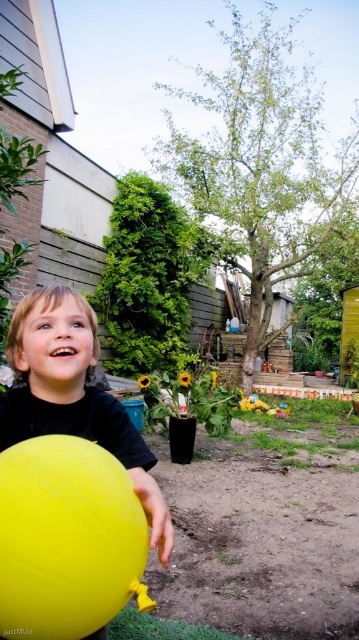
Question: Can you confirm if yellow rubber balloon at lower left is positioned to the left of plastic yellow toy at lower center?

Choices:
 (A) yes
 (B) no

Answer: (A)

Question: In this image, where is yellow rubber balloon at center located relative to plastic yellow toy at lower center?

Choices:
 (A) right
 (B) left

Answer: (B)

Question: Which object is closer to the camera taking this photo?

Choices:
 (A) plastic yellow toy at lower center
 (B) yellow rubber balloon at center

Answer: (B)

Question: Is yellow rubber balloon at lower left further to the viewer compared to plastic yellow toy at lower center?

Choices:
 (A) no
 (B) yes

Answer: (A)

Question: Which of the following is the farthest from the observer?

Choices:
 (A) (156, 508)
 (B) (268, 408)
 (C) (2, 621)

Answer: (B)

Question: Based on their relative distances, which object is farther from the yellow rubber balloon at lower left?

Choices:
 (A) yellow rubber balloon at center
 (B) plastic yellow toy at lower center

Answer: (B)